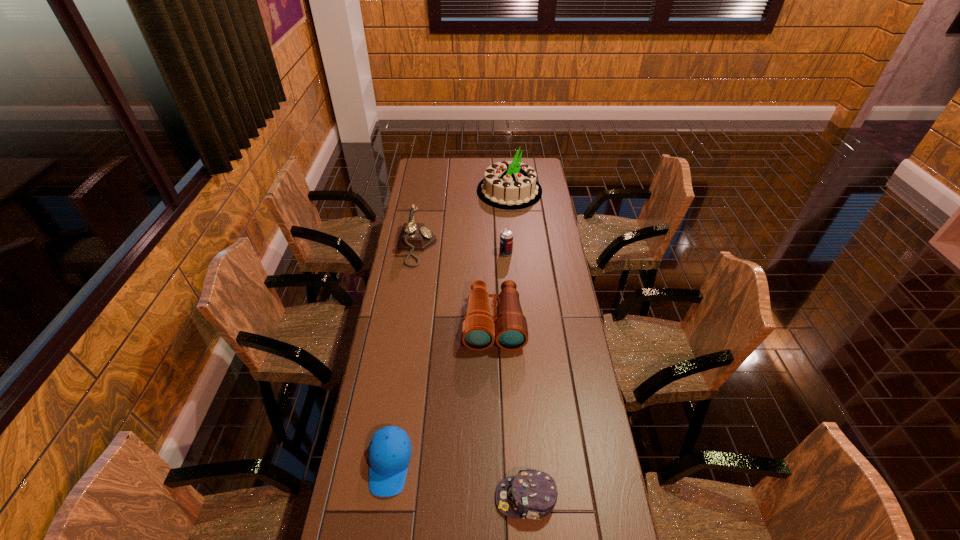
The height and width of the screenshot is (540, 960). I want to click on vacant space that is in between the right headwear and the third nearest object, so click(x=510, y=410).

Identify the location of free spot between the beer can and the left headwear. This screenshot has width=960, height=540. (447, 359).

This screenshot has height=540, width=960. In order to click on free space between the second tallest object and the beer can in this screenshot , I will do `click(462, 250)`.

Locate an element on the screen. The image size is (960, 540). free space between the right headwear and the telephone is located at coordinates (471, 373).

Identify which object is the second nearest to the beer can. Please provide its 2D coordinates. Your answer should be formatted as a tuple, i.e. [(x, y)], where the tuple contains the x and y coordinates of a point satisfying the conditions above.

[(414, 236)]

The height and width of the screenshot is (540, 960). I want to click on object that is the fourth closest to the right headwear, so click(x=506, y=236).